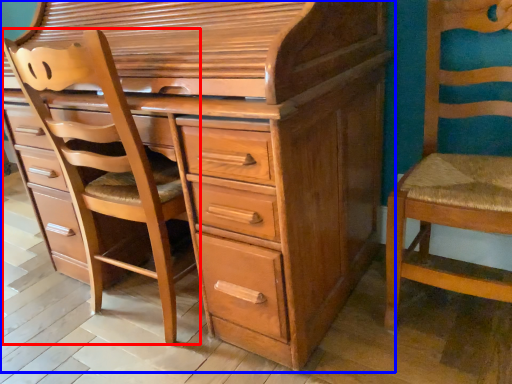
Question: Which object is further to the camera taking this photo, armchair (highlighted by a red box) or chest of drawers (highlighted by a blue box)?

Choices:
 (A) armchair
 (B) chest of drawers

Answer: (A)